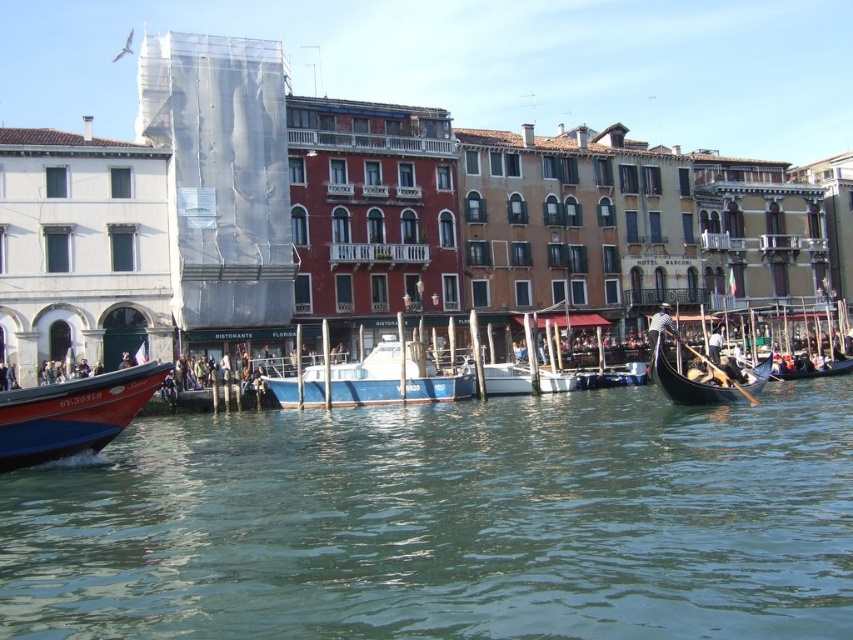
Which is behind, point (479, 616) or point (660, 307)?

Point (660, 307)

Between greenish water at center and black polished wood gondola at center, which one is positioned higher?

black polished wood gondola at center is above.

Between point (96, 483) and point (679, 372), which one is positioned in front?

Point (96, 483) is more forward.

Image resolution: width=853 pixels, height=640 pixels. I want to click on greenish water at center, so pos(445,522).

Who is positioned more to the right, greenish water at center or red glossy boat at lower left?

From the viewer's perspective, greenish water at center appears more on the right side.

Is point (809, 480) farther from camera compared to point (146, 385)?

No, (809, 480) is closer to viewer.

This screenshot has width=853, height=640. What do you see at coordinates (445, 522) in the screenshot?
I see `greenish water at center` at bounding box center [445, 522].

I want to click on greenish water at center, so click(445, 522).

Who is more forward, (102, 387) or (358, 368)?

Positioned in front is point (102, 387).

Identify the location of red glossy boat at lower left. (73, 413).

Between point (32, 428) and point (392, 337), which one is positioned behind?

The point (392, 337) is behind.

Where is `red glossy boat at lower left`? The height and width of the screenshot is (640, 853). red glossy boat at lower left is located at coordinates (73, 413).